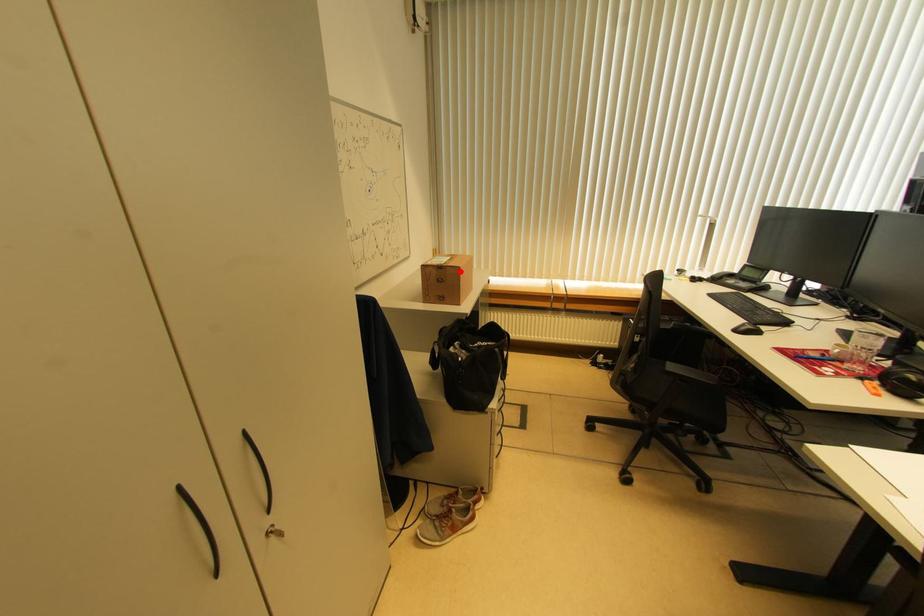
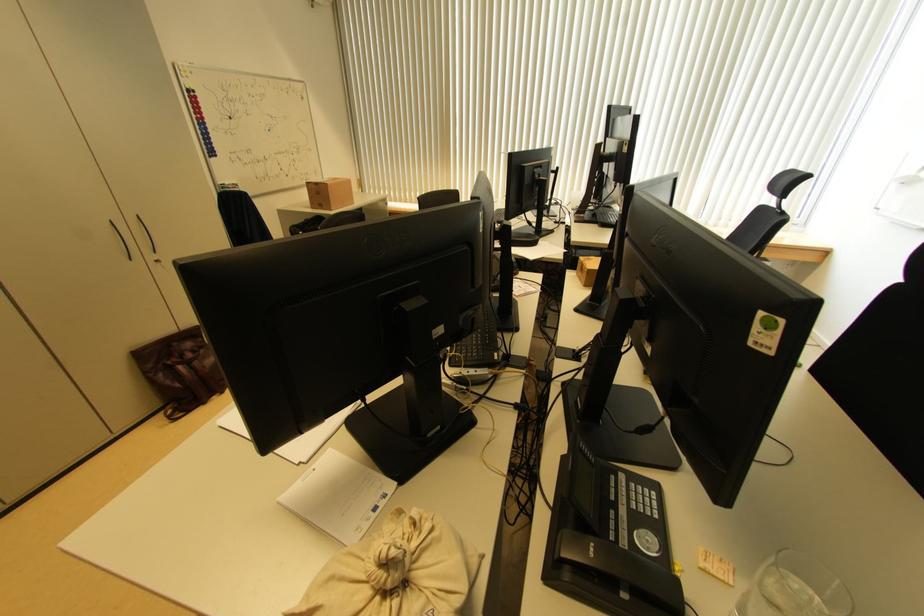
Question: I am providing you with two images of the same scene from different viewpoints. Given a red point in image1, look at the same physical point in image2. Is it:

Choices:
 (A) Closer to the viewpoint
 (B) Farther from the viewpoint

Answer: (A)